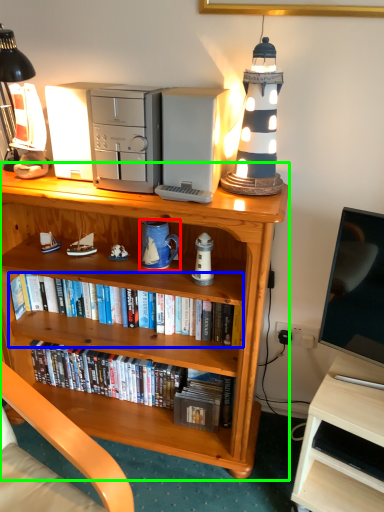
Question: Which object is positioned closest to mug (highlighted by a red box)? Select from book (highlighted by a blue box) and bookcase (highlighted by a green box).

Choices:
 (A) book
 (B) bookcase

Answer: (A)